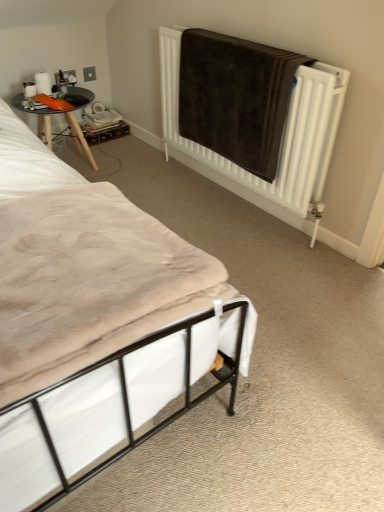
Identify the location of vacant area that is situated to the right of wooden table at left. (132, 162).